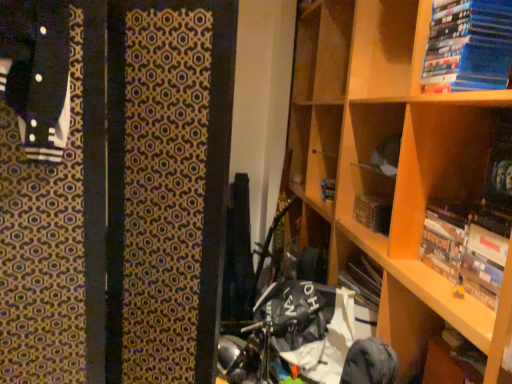
Question: From the image's perspective, is hardcover book at upper right, the first book in the bottom-to-top sequence, above or below blue matte book at upper right, acting as the second book starting from the bottom?

Choices:
 (A) above
 (B) below

Answer: (B)

Question: Is hardcover book at upper right, positioned as the second book in top-to-bottom order, inside the boundaries of blue matte book at upper right, marked as the 1th book in a top-to-bottom arrangement, or outside?

Choices:
 (A) inside
 (B) outside

Answer: (B)

Question: Which of these objects is positioned farthest from the blue matte book at upper right, marked as the 1th book in a top-to-bottom arrangement?

Choices:
 (A) hardcover book at upper right, the first book in the bottom-to-top sequence
 (B) wooden bookshelf at upper right
 (C) hardcover book at center

Answer: (C)

Question: Based on their relative distances, which object is nearer to the hardcover book at upper right, positioned as the second book in top-to-bottom order?

Choices:
 (A) blue matte book at upper right, marked as the 1th book in a top-to-bottom arrangement
 (B) wooden bookshelf at upper right
 (C) hardcover book at center

Answer: (B)